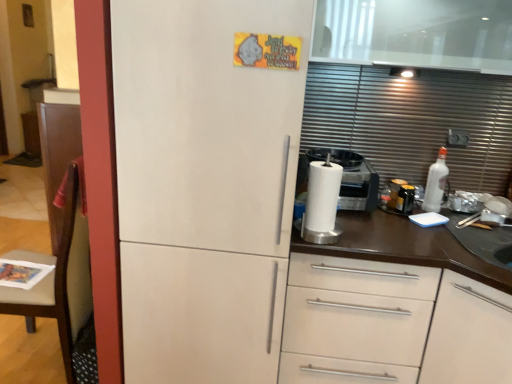
Question: Is white matte refrigerator at center positioned far away from white matte cabinet at center?

Choices:
 (A) no
 (B) yes

Answer: (A)

Question: Can you confirm if white matte refrigerator at center is taller than white matte cabinet at center?

Choices:
 (A) yes
 (B) no

Answer: (A)

Question: Is white matte cabinet at center inside white matte refrigerator at center?

Choices:
 (A) yes
 (B) no

Answer: (B)

Question: Is white matte refrigerator at center to the left of white matte cabinet at center from the viewer's perspective?

Choices:
 (A) no
 (B) yes

Answer: (B)

Question: Could you tell me if white matte refrigerator at center is turned towards white matte cabinet at center?

Choices:
 (A) yes
 (B) no

Answer: (B)

Question: Considering their positions, is white matte refrigerator at center located in front of or behind brown wood chair at left?

Choices:
 (A) front
 (B) behind

Answer: (A)

Question: Considering the positions of white matte refrigerator at center and brown wood chair at left in the image, is white matte refrigerator at center taller or shorter than brown wood chair at left?

Choices:
 (A) tall
 (B) short

Answer: (A)

Question: In the image, is white matte refrigerator at center on the left side or the right side of brown wood chair at left?

Choices:
 (A) right
 (B) left

Answer: (A)

Question: From the image's perspective, relative to brown wood chair at left, is white matte refrigerator at center above or below?

Choices:
 (A) above
 (B) below

Answer: (A)

Question: Is point (309, 274) closer or farther from the camera than point (283, 89)?

Choices:
 (A) closer
 (B) farther

Answer: (B)

Question: From the image's perspective, is white matte cabinet at center above or below white matte refrigerator at center?

Choices:
 (A) above
 (B) below

Answer: (B)

Question: From a real-world perspective, is white matte cabinet at center above or below white matte refrigerator at center?

Choices:
 (A) below
 (B) above

Answer: (A)

Question: Looking at their shapes, would you say white matte cabinet at center is wider or thinner than white matte refrigerator at center?

Choices:
 (A) wide
 (B) thin

Answer: (B)

Question: From the image's perspective, is brown wood chair at left above or below white matte refrigerator at center?

Choices:
 (A) above
 (B) below

Answer: (B)

Question: In terms of height, does brown wood chair at left look taller or shorter compared to white matte refrigerator at center?

Choices:
 (A) short
 (B) tall

Answer: (A)